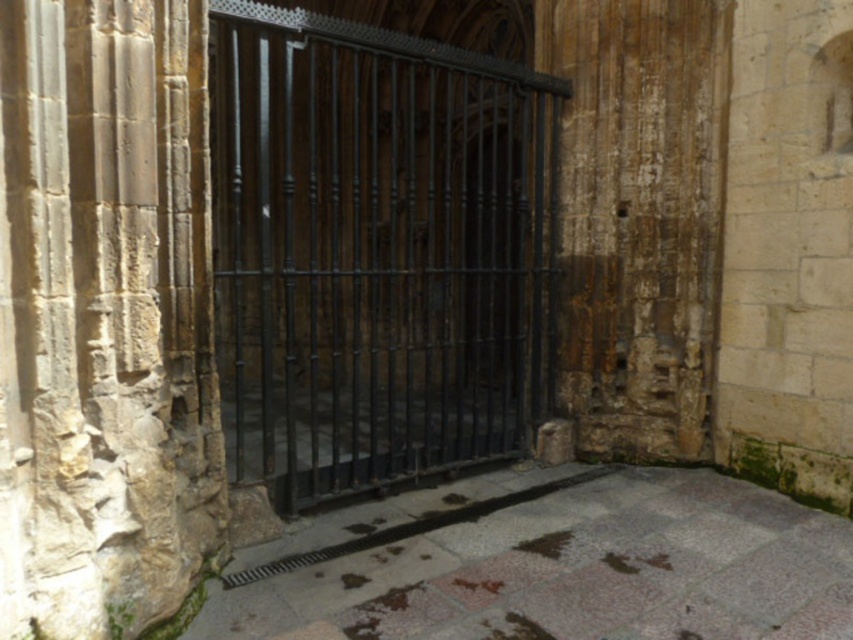
Question: Considering the relative positions of black wrought iron gate at center and stone textured pillar at center in the image provided, where is black wrought iron gate at center located with respect to stone textured pillar at center?

Choices:
 (A) left
 (B) right

Answer: (A)

Question: Is black wrought iron gate at center smaller than stone textured pillar at center?

Choices:
 (A) no
 (B) yes

Answer: (B)

Question: Which object appears farthest from the camera in this image?

Choices:
 (A) black wrought iron gate at center
 (B) stone textured pillar at center

Answer: (A)

Question: Does black wrought iron gate at center have a smaller size compared to stone textured pillar at center?

Choices:
 (A) yes
 (B) no

Answer: (A)

Question: Among these points, which one is farthest from the camera?

Choices:
 (A) (328, 68)
 (B) (198, 419)

Answer: (A)